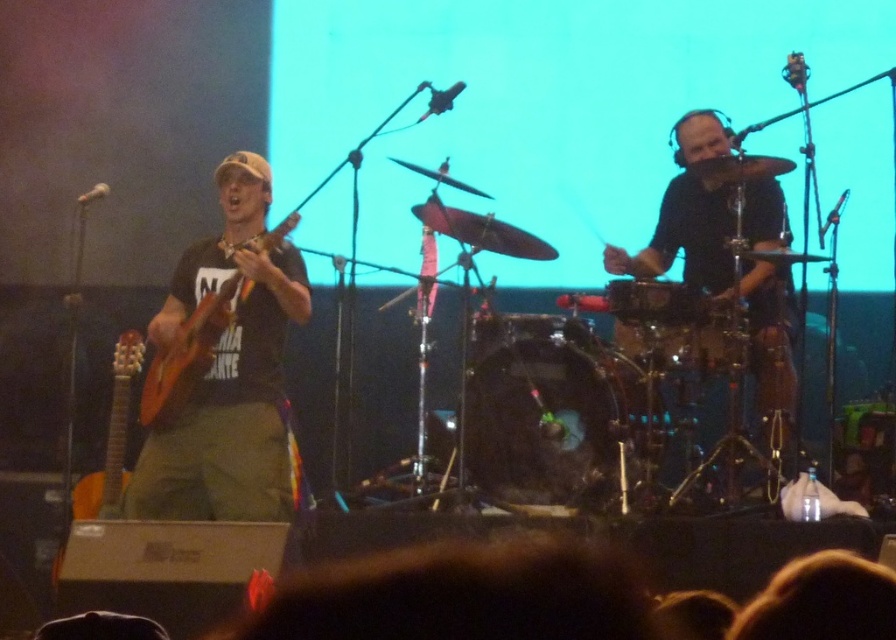
Does matte black guitar at left have a lesser height compared to shiny black drum at center?

Incorrect, matte black guitar at left's height does not fall short of shiny black drum at center's.

Is point (239, 198) farther from viewer compared to point (619, 304)?

Yes, it is behind point (619, 304).

Which is behind, point (127, 508) or point (643, 317)?

Positioned behind is point (643, 317).

This screenshot has height=640, width=896. What are the coordinates of `matte black guitar at left` in the screenshot? It's located at (228, 371).

Which of these two, orange wood guitar at left or acoustic wood guitar at left, stands taller?

Standing taller between the two is acoustic wood guitar at left.

Between orange wood guitar at left and acoustic wood guitar at left, which one is positioned higher?

orange wood guitar at left

This screenshot has height=640, width=896. What do you see at coordinates (187, 353) in the screenshot?
I see `orange wood guitar at left` at bounding box center [187, 353].

Locate an element on the screen. orange wood guitar at left is located at coordinates (187, 353).

Does black drum at center have a larger size compared to black matte drum set at right?

No, black drum at center is not bigger than black matte drum set at right.

Looking at this image, does black drum at center have a greater height compared to black matte drum set at right?

In fact, black drum at center may be shorter than black matte drum set at right.

Identify the location of black drum at center. (554, 412).